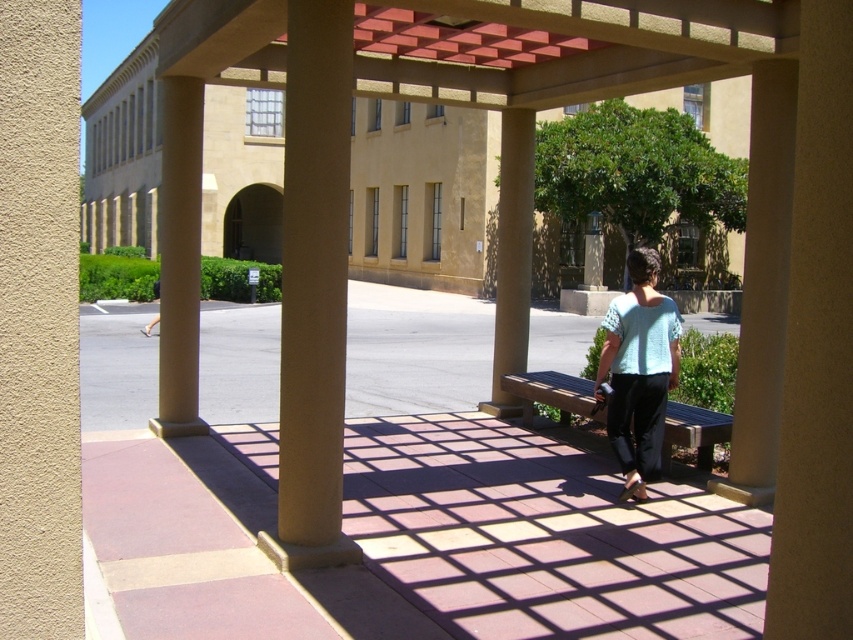
You are standing at the entrance of the covered walkway and want to reach the beige concrete pillar at center. There is a beige polished stone column at center blocking your path. Can you walk around it to reach your destination?

The beige polished stone column at center is in front of the beige concrete pillar at center, so you can walk around the beige polished stone column at center to reach the beige concrete pillar at center since it is blocking the direct path.

In the scene shown: You are standing at the entrance of the walkway and notice two beige columns ahead of you. Which one is more to the left, the beige polished stone column at center or the beige concrete pillar at center?

The beige polished stone column at center is more to the left than the beige concrete pillar at center.